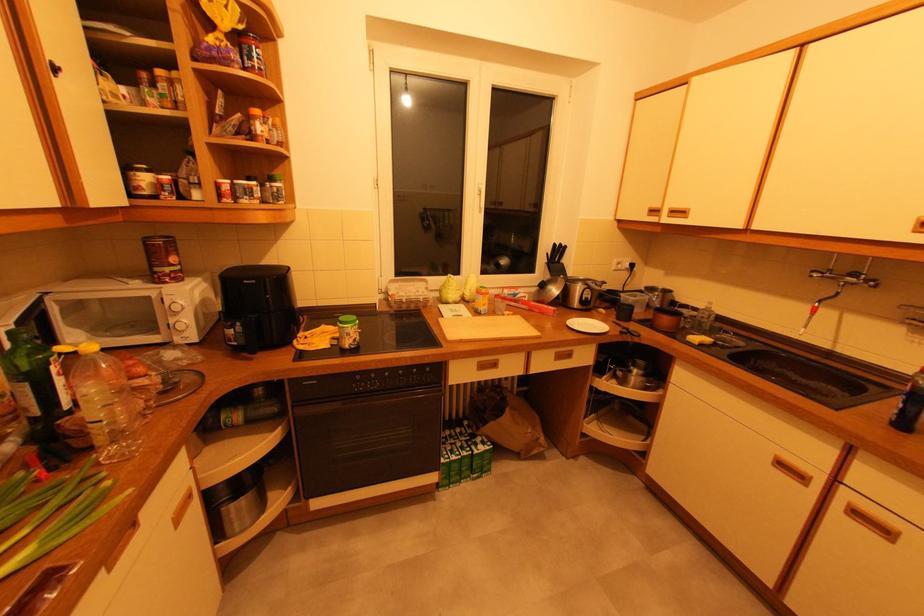
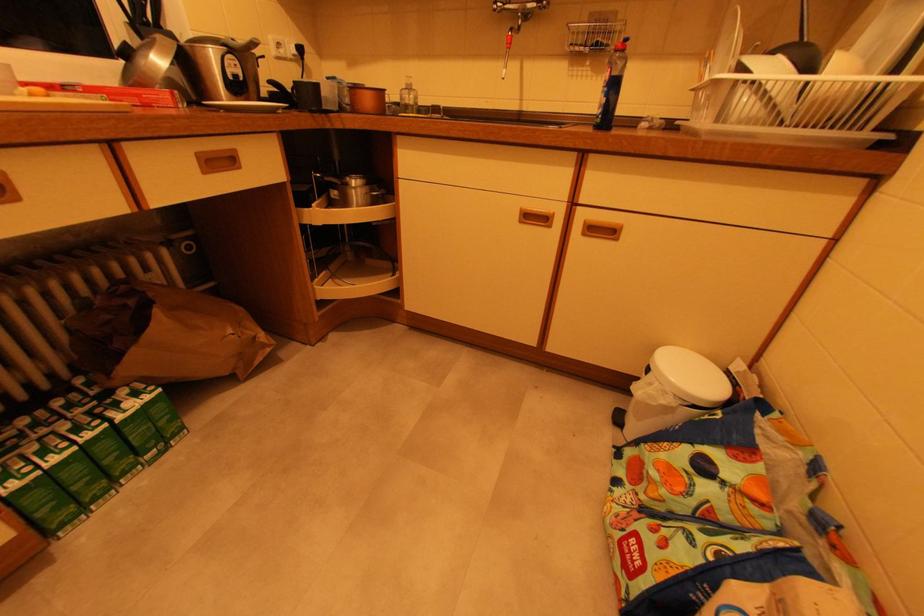
Locate, in the second image, the point that corresponds to [638,371] in the first image.

(355, 185)